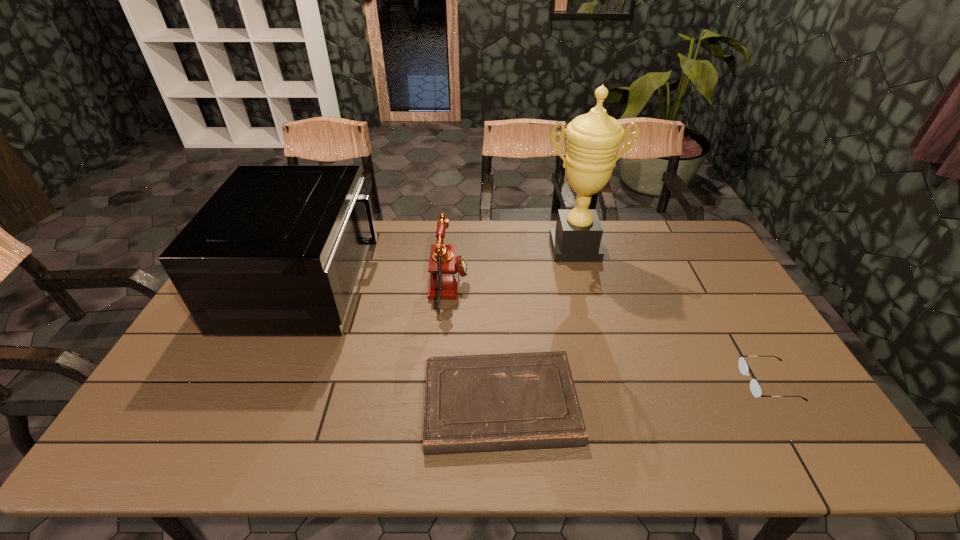
Identify the location of vacant space located on the lenses of the spectacles. (664, 382).

Locate an element on the screen. The width and height of the screenshot is (960, 540). free region located on the lenses of the spectacles is located at coordinates (622, 382).

Find the location of a particular element. Image resolution: width=960 pixels, height=540 pixels. free space located on the right of the paperback book is located at coordinates (659, 404).

Image resolution: width=960 pixels, height=540 pixels. Find the location of `trophy cup located in the far edge section of the desktop`. trophy cup located in the far edge section of the desktop is located at coordinates (593, 140).

Find the location of a particular element. This screenshot has height=540, width=960. microwave_oven positioned at the far edge is located at coordinates (278, 249).

Where is `object that is at the near edge`? object that is at the near edge is located at coordinates (515, 401).

The width and height of the screenshot is (960, 540). What are the coordinates of `object present at the left edge` in the screenshot? It's located at (278, 249).

This screenshot has height=540, width=960. In order to click on object that is positioned at the right edge in this screenshot , I will do `click(755, 388)`.

You are a GUI agent. You are given a task and a screenshot of the screen. Output one action in this format:
    pyautogui.click(x=<x>, y=<y>)
    Task: Click on the object situated at the far left corner
    
    Given the screenshot: What is the action you would take?
    pyautogui.click(x=278, y=249)

You are a GUI agent. You are given a task and a screenshot of the screen. Output one action in this format:
    pyautogui.click(x=<x>, y=<y>)
    Task: Click on the free space at the far edge
    The width and height of the screenshot is (960, 540).
    Given the screenshot: What is the action you would take?
    pyautogui.click(x=527, y=252)